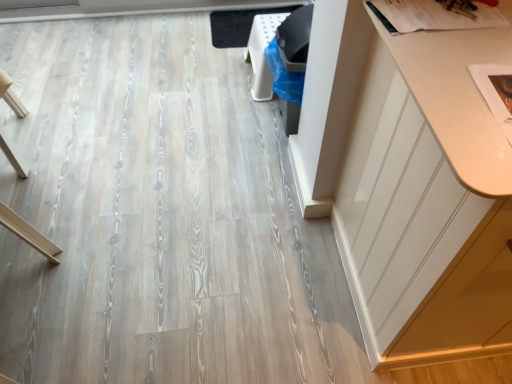
At what (x,y) coordinates should I click in order to perform the action: click on white wood cabinet at lower right. Please return your answer as a coordinate pair (x, y). Image resolution: width=512 pixels, height=384 pixels. Looking at the image, I should click on (426, 198).

Describe the element at coordinates (426, 198) in the screenshot. I see `white wood cabinet at lower right` at that location.

Find the location of `white wood cabinet at lower right`. white wood cabinet at lower right is located at coordinates (426, 198).